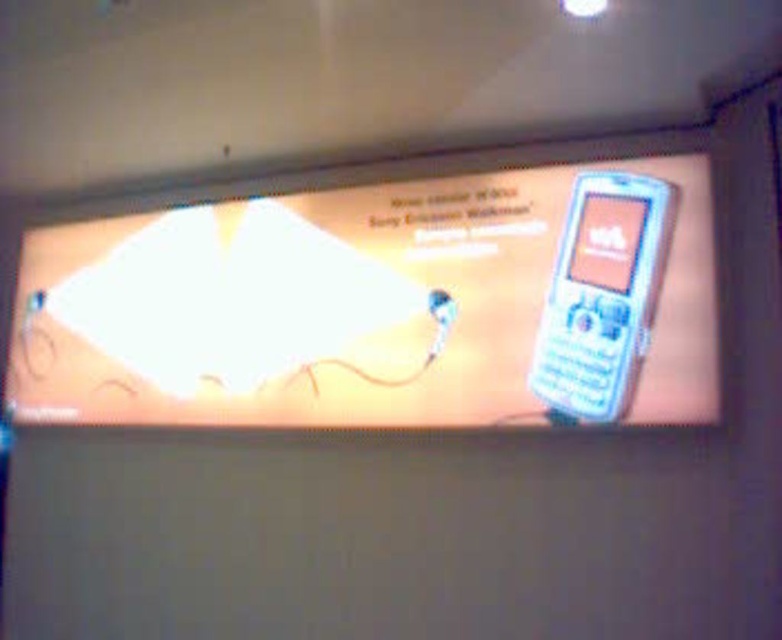
Question: Among these objects, which one is nearest to the camera?

Choices:
 (A) white plastic phone at right
 (B) white plastic phone at center

Answer: (B)

Question: Which point is closer to the camera?

Choices:
 (A) white plastic phone at center
 (B) white plastic phone at right

Answer: (A)

Question: Is white plastic phone at center below white plastic phone at right?

Choices:
 (A) no
 (B) yes

Answer: (A)

Question: Where is white plastic phone at center located in relation to white plastic phone at right in the image?

Choices:
 (A) left
 (B) right

Answer: (A)

Question: Which of the following is the closest to the observer?

Choices:
 (A) (551, 396)
 (B) (589, 406)

Answer: (B)

Question: Can you confirm if white plastic phone at center is positioned to the right of white plastic phone at right?

Choices:
 (A) no
 (B) yes

Answer: (A)